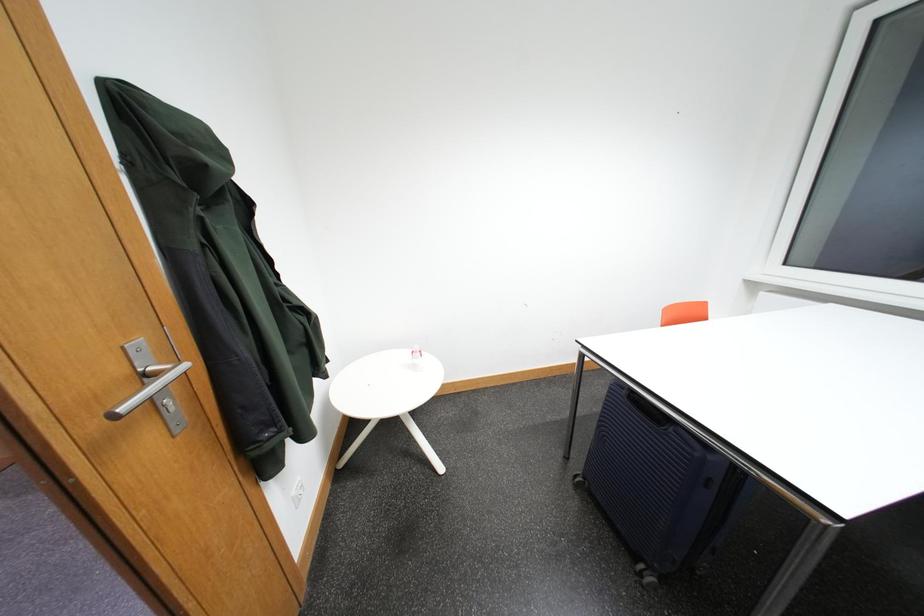
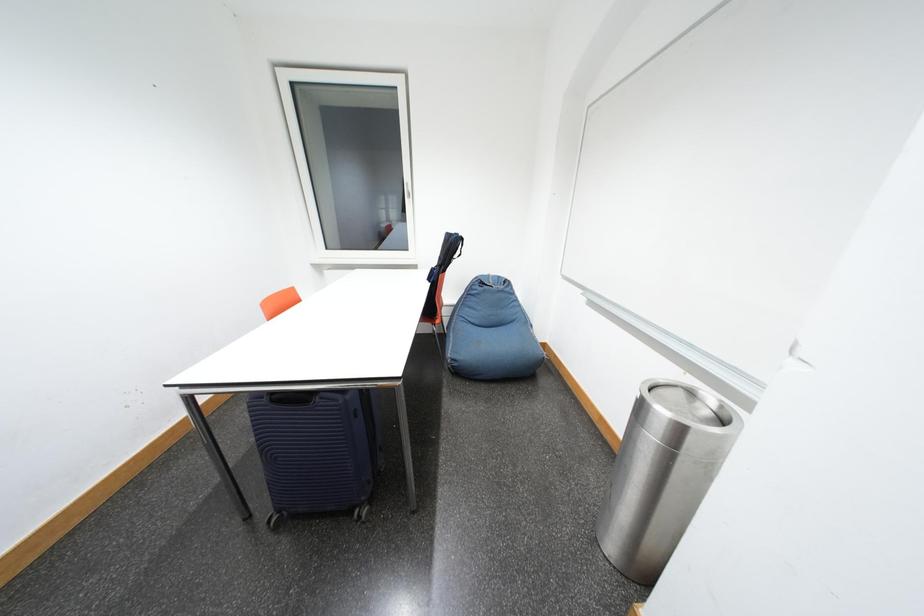
Based on the continuous images, in which direction is the camera rotating?

The camera rotated toward right-down.